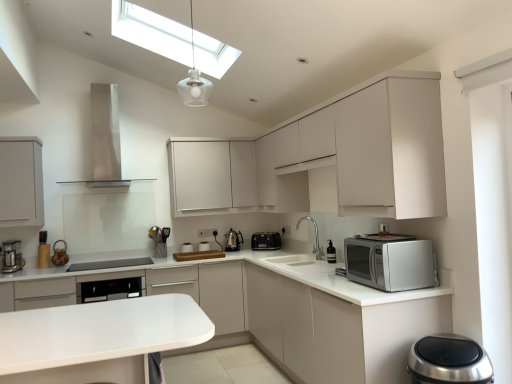
Question: Is stainless steel range hood at upper center, acting as the second home appliance starting from the bottom, spatially inside white matte cabinet at right, arranged as the 4th cabinetry when viewed from the left, or outside of it?

Choices:
 (A) inside
 (B) outside

Answer: (B)

Question: In terms of height, does stainless steel range hood at upper center, acting as the second home appliance starting from the bottom, look taller or shorter compared to white matte cabinet at right, positioned as the 1th cabinetry in right-to-left order?

Choices:
 (A) tall
 (B) short

Answer: (A)

Question: Based on their relative distances, which object is farther from the white glass pendant light at upper center?

Choices:
 (A) matte white cabinet at left, placed as the 4th cabinetry when sorted from right to left
 (B) white matte cabinet at upper center, the 3th cabinetry in the right-to-left sequence
 (C) stainless steel range hood at upper center, positioned as the 1th home appliance in left-to-right order
 (D) silver metallic microwave at right, which is the second home appliance in left-to-right order
 (E) metallic silver coffee maker at left

Answer: (D)

Question: Estimate the real-world distances between objects in this image. Which object is closer to the white glass pendant light at upper center?

Choices:
 (A) metallic silver kettle at center, the 2th appliance when ordered from right to left
 (B) satin silver trash can at lower right, the first appliance positioned from the front
 (C) silver metallic microwave at right, the 2th home appliance in the back-to-front sequence
 (D) matte white cabinet at left, arranged as the first cabinetry when viewed from the left
 (E) metallic silver utensil holder at center, the 4th appliance in the right-to-left sequence

Answer: (E)